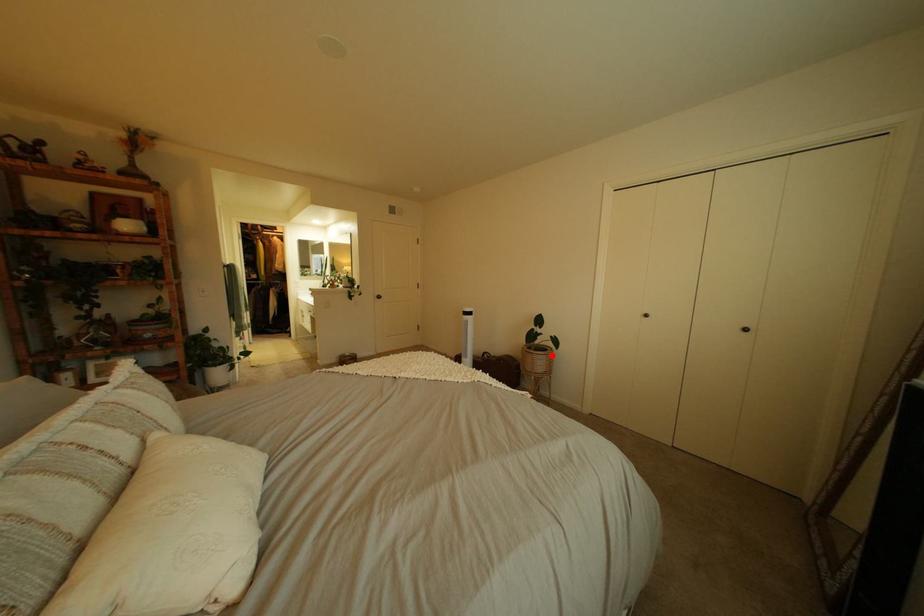
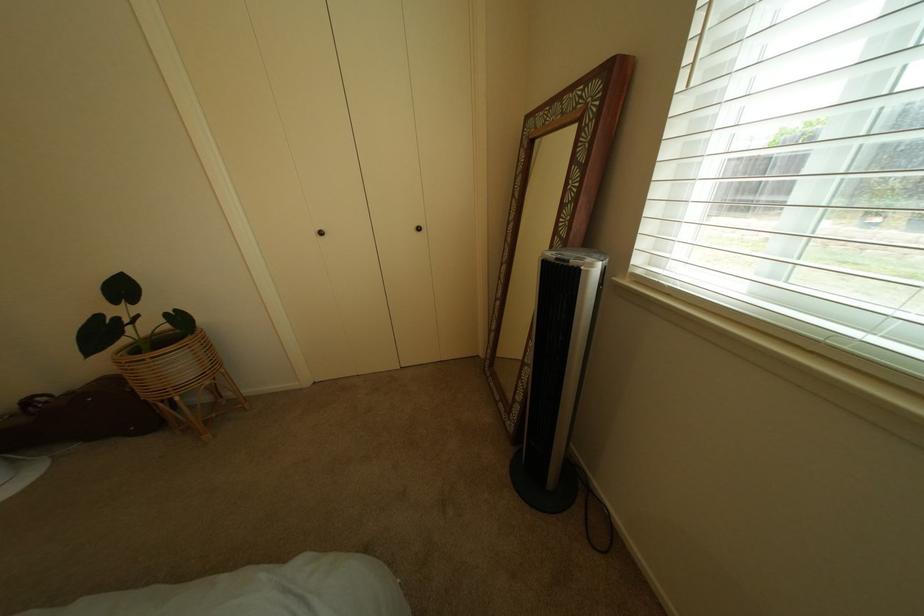
Question: I am providing you with two images of the same scene from different viewpoints. Given a red point in image1, look at the same physical point in image2. Is it:

Choices:
 (A) Closer to the viewpoint
 (B) Farther from the viewpoint

Answer: (A)